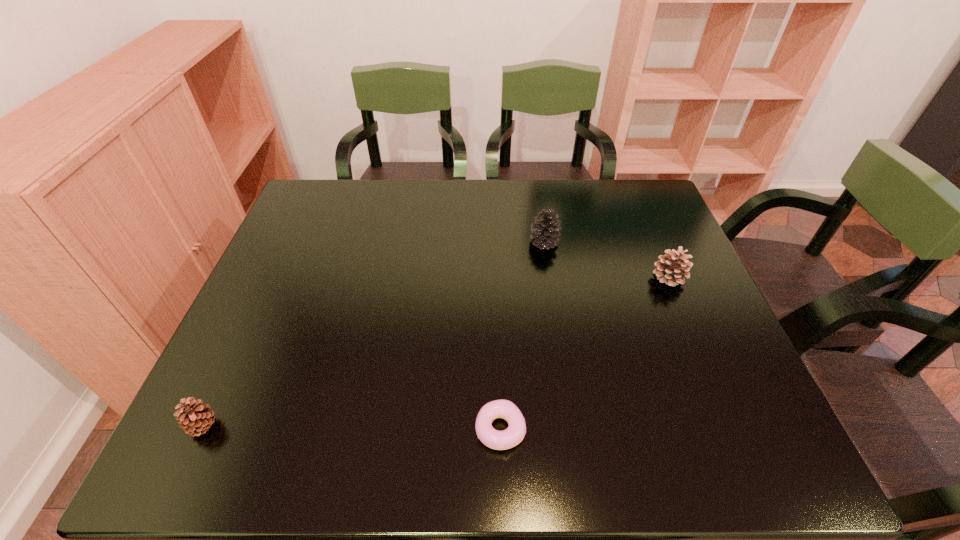
This screenshot has height=540, width=960. Identify the location of free space at the right edge. (661, 299).

Identify the location of vacant space at the far right corner of the desktop. This screenshot has width=960, height=540. (643, 194).

Where is `vacant space at the near right corner`? The image size is (960, 540). vacant space at the near right corner is located at coordinates (772, 455).

The width and height of the screenshot is (960, 540). Find the location of `blank region between the third object from right to left and the third object from left to right`. blank region between the third object from right to left and the third object from left to right is located at coordinates (522, 336).

Where is `vacant space that's between the doughnut and the leftmost pinecone`? The width and height of the screenshot is (960, 540). vacant space that's between the doughnut and the leftmost pinecone is located at coordinates (352, 428).

Where is `unoccupied area between the farthest object and the second nearest pinecone`? The image size is (960, 540). unoccupied area between the farthest object and the second nearest pinecone is located at coordinates (607, 260).

Identify the location of empty location between the rightmost pinecone and the shortest object. (585, 353).

What are the coordinates of `free space between the third object from right to left and the rightmost pinecone` in the screenshot? It's located at (585, 353).

You are a GUI agent. You are given a task and a screenshot of the screen. Output one action in this format:
    pyautogui.click(x=<x>, y=<y>)
    Task: Click on the empty space between the second pinecone from left to right and the rightmost pinecone
    This screenshot has height=540, width=960.
    Given the screenshot: What is the action you would take?
    [x=607, y=260]

Where is `vacant region between the shortest object and the second pinecone from right to left`? This screenshot has width=960, height=540. vacant region between the shortest object and the second pinecone from right to left is located at coordinates (522, 336).